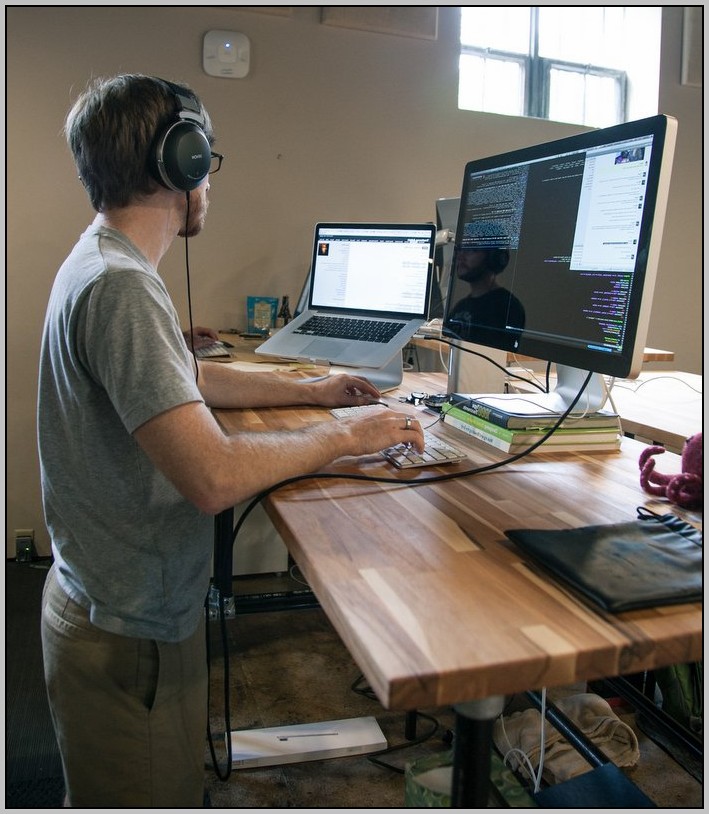
You are a GUI agent. You are given a task and a screenshot of the screen. Output one action in this format:
    pyautogui.click(x=<x>, y=<y>)
    Task: Click on the mac keyboard
    Image resolution: width=709 pixels, height=814 pixels.
    Given the screenshot: What is the action you would take?
    pyautogui.click(x=362, y=405)